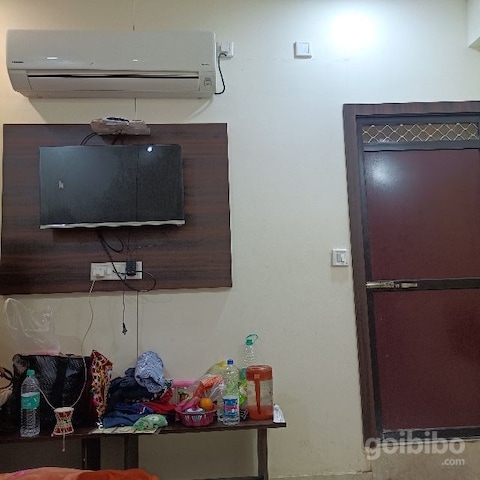
In order to click on wall below window in this screenshot , I will do `click(420, 466)`.